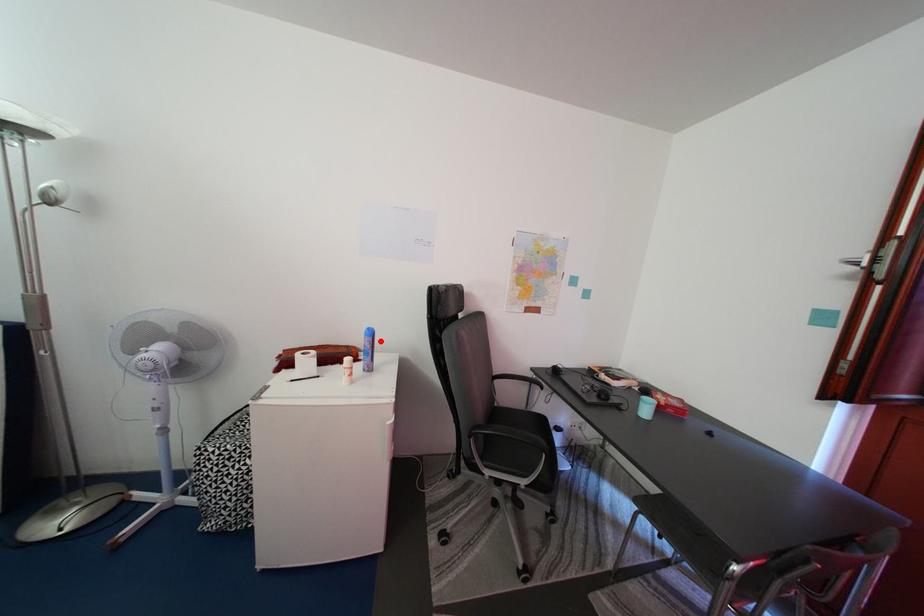
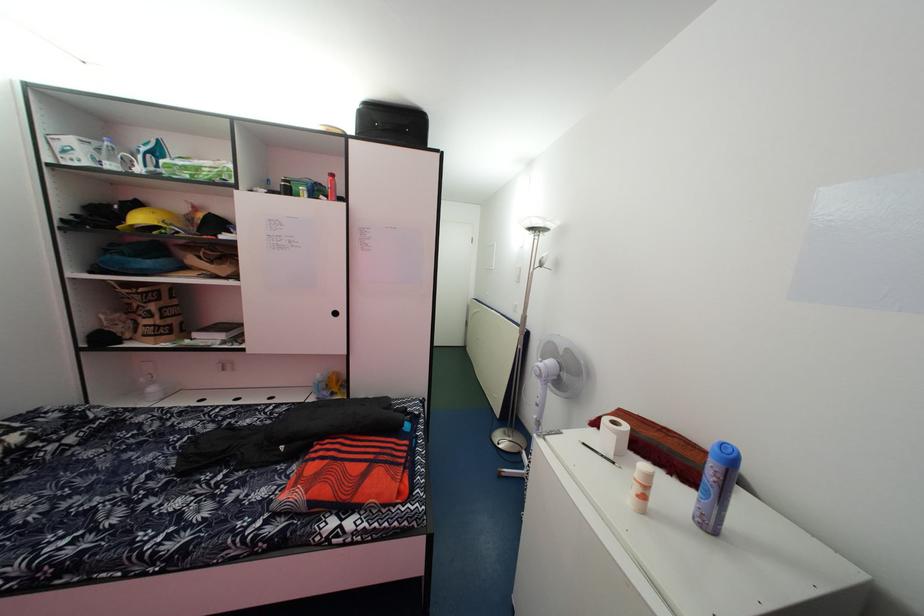
Locate, in the second image, the point that corresponds to the highlighted location in the first image.

(738, 466)